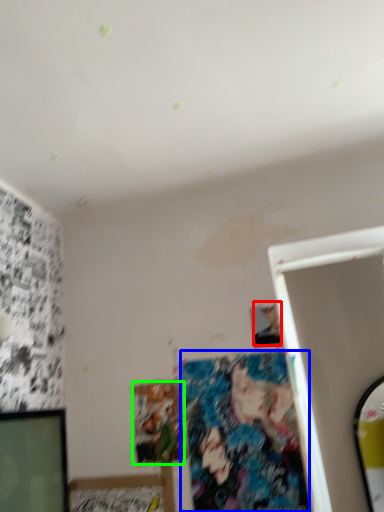
Question: Which object is positioned farthest from person (highlighted by a red box)? Select from art (highlighted by a blue box) and art (highlighted by a green box).

Choices:
 (A) art
 (B) art

Answer: (B)